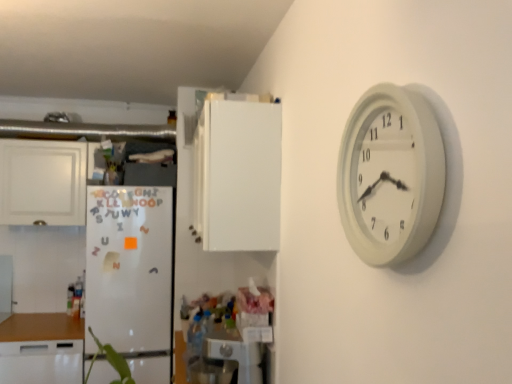
Describe the element at coordinates (390, 175) in the screenshot. This screenshot has height=384, width=512. I see `white plastic wall clock at upper right` at that location.

Locate an element on the screen. metallic silver appliance at lower center is located at coordinates (236, 353).

Find the location of `white matte cabinet at left, the 1th cabinetry in the left-to-right sequence`. white matte cabinet at left, the 1th cabinetry in the left-to-right sequence is located at coordinates (42, 182).

At what (x,y) coordinates should I click in order to perform the action: click on white plastic wall clock at upper right. Please return your answer as a coordinate pair (x, y). The height and width of the screenshot is (384, 512). Looking at the image, I should click on (390, 175).

Are white matte cabinet at left, which is the first cabinetry from back to front, and white matte refrigerator at left far apart?

They are positioned close to each other.

Is white matte cabinet at left, marked as the 2th cabinetry in a front-to-back arrangement, in front of white matte refrigerator at left?

No.

From the image's perspective, is white matte cabinet at left, the 2th cabinetry in the right-to-left sequence, located beneath white matte refrigerator at left?

No.

Visually, is white matte refrigerator at left positioned to the left or to the right of white matte cabinet at left, the 1th cabinetry in the left-to-right sequence?

white matte refrigerator at left is to the right of white matte cabinet at left, the 1th cabinetry in the left-to-right sequence.

Is point (153, 255) closer to camera compared to point (17, 221)?

Yes, it is.

Is white matte refrigerator at left positioned with its back to white matte cabinet at left, which is the first cabinetry from back to front?

white matte refrigerator at left does not have its back to white matte cabinet at left, which is the first cabinetry from back to front.

Is white matte refrigerator at left positioned far away from white matte cabinet at left, the 2th cabinetry in the right-to-left sequence?

No, white matte refrigerator at left is not far away from white matte cabinet at left, the 2th cabinetry in the right-to-left sequence.

How far apart are white plastic wall clock at upper right and white matte cabinet at center, arranged as the first cabinetry when viewed from the right?

white plastic wall clock at upper right is 36.33 inches from white matte cabinet at center, arranged as the first cabinetry when viewed from the right.

Considering the sizes of objects white plastic wall clock at upper right and white matte cabinet at center, arranged as the first cabinetry when viewed from the front, in the image provided, who is shorter, white plastic wall clock at upper right or white matte cabinet at center, arranged as the first cabinetry when viewed from the front,?

white plastic wall clock at upper right is shorter.

Could white matte cabinet at center, arranged as the first cabinetry when viewed from the front, be considered to be inside white plastic wall clock at upper right?

No, white matte cabinet at center, arranged as the first cabinetry when viewed from the front, is not inside white plastic wall clock at upper right.

In the scene shown: Visually, is white plastic wall clock at upper right positioned to the left or to the right of white matte cabinet at center, acting as the second cabinetry starting from the back?

In the image, white plastic wall clock at upper right appears on the right side of white matte cabinet at center, acting as the second cabinetry starting from the back.

From a real-world perspective, between white matte refrigerator at left and white matte cabinet at center, acting as the second cabinetry starting from the back, who is vertically higher?

In real-world perspective, white matte cabinet at center, acting as the second cabinetry starting from the back, is above.

Which of these two, white matte refrigerator at left or white matte cabinet at center, positioned as the 2th cabinetry in left-to-right order, is thinner?

white matte cabinet at center, positioned as the 2th cabinetry in left-to-right order.

Consider the image. Can white matte cabinet at center, positioned as the 2th cabinetry in left-to-right order, be found inside white matte refrigerator at left?

No.

Is white matte refrigerator at left closer to camera compared to white matte cabinet at center, acting as the second cabinetry starting from the back?

No, it is behind white matte cabinet at center, acting as the second cabinetry starting from the back.

Can you confirm if white matte cabinet at center, acting as the second cabinetry starting from the back, is taller than metallic silver appliance at lower center?

Yes.

From the image's perspective, is white matte cabinet at center, arranged as the first cabinetry when viewed from the front, above or below metallic silver appliance at lower center?

Based on their image positions, white matte cabinet at center, arranged as the first cabinetry when viewed from the front, is located above metallic silver appliance at lower center.

What's the angular difference between white matte cabinet at center, acting as the second cabinetry starting from the back, and metallic silver appliance at lower center's facing directions?

1.56 degrees separate the facing orientations of white matte cabinet at center, acting as the second cabinetry starting from the back, and metallic silver appliance at lower center.

Is metallic silver appliance at lower center at the back of white matte cabinet at center, arranged as the first cabinetry when viewed from the right?

white matte cabinet at center, arranged as the first cabinetry when viewed from the right, is not turned away from metallic silver appliance at lower center.

Would you consider white matte cabinet at center, acting as the second cabinetry starting from the back, to be distant from white matte refrigerator at left?

Actually, white matte cabinet at center, acting as the second cabinetry starting from the back, and white matte refrigerator at left are a little close together.

Would you say white matte refrigerator at left is part of white matte cabinet at center, positioned as the 2th cabinetry in left-to-right order,'s contents?

Definitely not — white matte refrigerator at left is not inside white matte cabinet at center, positioned as the 2th cabinetry in left-to-right order.

Is white matte cabinet at center, positioned as the 2th cabinetry in left-to-right order, positioned behind white matte refrigerator at left?

No, it is in front of white matte refrigerator at left.

From the image's perspective, which is above, white matte cabinet at center, acting as the second cabinetry starting from the back, or white matte refrigerator at left?

white matte cabinet at center, acting as the second cabinetry starting from the back, from the image's perspective.

From the image's perspective, is metallic silver appliance at lower center below white plastic wall clock at upper right?

Indeed, from the image's perspective, metallic silver appliance at lower center is shown beneath white plastic wall clock at upper right.

Does metallic silver appliance at lower center have a larger size compared to white plastic wall clock at upper right?

Indeed, metallic silver appliance at lower center has a larger size compared to white plastic wall clock at upper right.

Would you say metallic silver appliance at lower center is inside or outside white plastic wall clock at upper right?

metallic silver appliance at lower center is spatially situated outside white plastic wall clock at upper right.

Locate an element on the screen. The height and width of the screenshot is (384, 512). fridge below the white matte cabinet at left, which is the first cabinetry from back to front (from a real-world perspective) is located at coordinates (131, 276).

The width and height of the screenshot is (512, 384). In order to click on cabinetry that is the 1st one above the white matte refrigerator at left (from a real-world perspective) in this screenshot , I will do `click(42, 182)`.

From the picture: From the image, which object appears to be nearer to white plastic wall clock at upper right, white matte cabinet at center, arranged as the first cabinetry when viewed from the front, or white matte cabinet at left, the 2th cabinetry in the right-to-left sequence?

The object closer to white plastic wall clock at upper right is white matte cabinet at center, arranged as the first cabinetry when viewed from the front.

Which object lies nearer to the anchor point metallic silver appliance at lower center, white matte cabinet at left, the 2th cabinetry in the right-to-left sequence, or white plastic wall clock at upper right?

white plastic wall clock at upper right is closer to metallic silver appliance at lower center.

When comparing their distances from white matte refrigerator at left, does white matte cabinet at left, marked as the 2th cabinetry in a front-to-back arrangement, or white matte cabinet at center, positioned as the 2th cabinetry in left-to-right order, seem closer?

white matte cabinet at left, marked as the 2th cabinetry in a front-to-back arrangement, is positioned closer to the anchor white matte refrigerator at left.

Considering their positions, is white matte cabinet at center, arranged as the first cabinetry when viewed from the right, positioned further to metallic silver appliance at lower center than white plastic wall clock at upper right?

Based on the image, white plastic wall clock at upper right appears to be further to metallic silver appliance at lower center.

Looking at the image, which one is located further to white matte cabinet at center, positioned as the 2th cabinetry in left-to-right order, white plastic wall clock at upper right or white matte cabinet at left, marked as the 2th cabinetry in a front-to-back arrangement?

Among the two, white matte cabinet at left, marked as the 2th cabinetry in a front-to-back arrangement, is located further to white matte cabinet at center, positioned as the 2th cabinetry in left-to-right order.

When comparing their distances from white matte cabinet at left, marked as the 2th cabinetry in a front-to-back arrangement, does metallic silver appliance at lower center or white matte cabinet at center, arranged as the first cabinetry when viewed from the front, seem closer?

Among the two, white matte cabinet at center, arranged as the first cabinetry when viewed from the front, is located nearer to white matte cabinet at left, marked as the 2th cabinetry in a front-to-back arrangement.

When comparing their distances from white matte cabinet at center, positioned as the 2th cabinetry in left-to-right order, does white plastic wall clock at upper right or white matte refrigerator at left seem closer?

Among the two, white matte refrigerator at left is located nearer to white matte cabinet at center, positioned as the 2th cabinetry in left-to-right order.

Looking at the image, which one is located closer to white matte cabinet at left, the 1th cabinetry in the left-to-right sequence, white matte refrigerator at left or white matte cabinet at center, acting as the second cabinetry starting from the back?

white matte refrigerator at left is closer to white matte cabinet at left, the 1th cabinetry in the left-to-right sequence.

What are the coordinates of `appliance positioned between white matte cabinet at center, arranged as the first cabinetry when viewed from the right, and white matte refrigerator at left from near to far` in the screenshot? It's located at point(236,353).

Find the location of a particular element. This screenshot has width=512, height=384. fridge situated between white matte cabinet at left, marked as the 2th cabinetry in a front-to-back arrangement, and white matte cabinet at center, arranged as the first cabinetry when viewed from the right, from left to right is located at coordinates (131, 276).

Identify the location of fridge between white plastic wall clock at upper right and white matte cabinet at left, the 1th cabinetry in the left-to-right sequence, from front to back. The height and width of the screenshot is (384, 512). (131, 276).

In order to click on cabinetry between white plastic wall clock at upper right and white matte cabinet at left, the 1th cabinetry in the left-to-right sequence, in the front-back direction in this screenshot , I will do `click(234, 172)`.